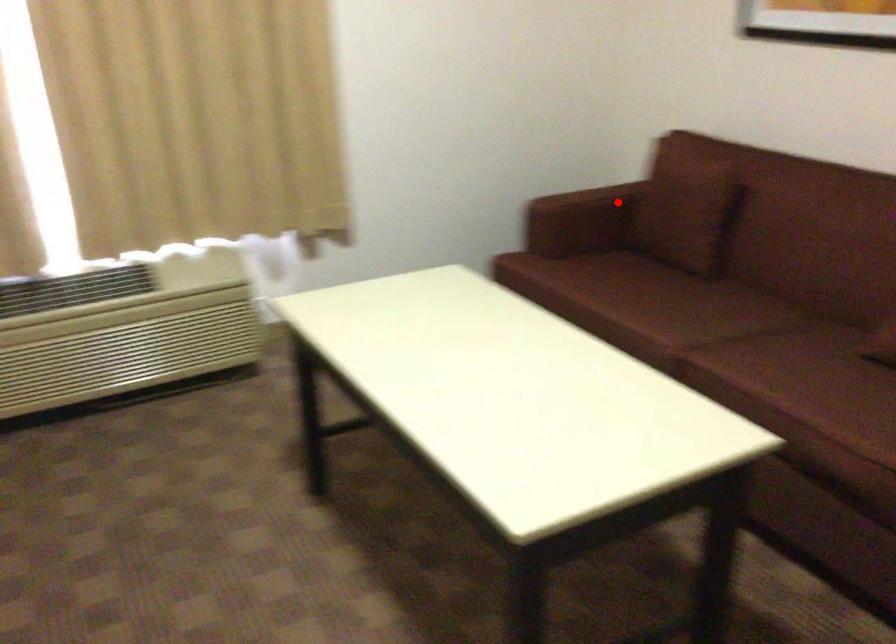
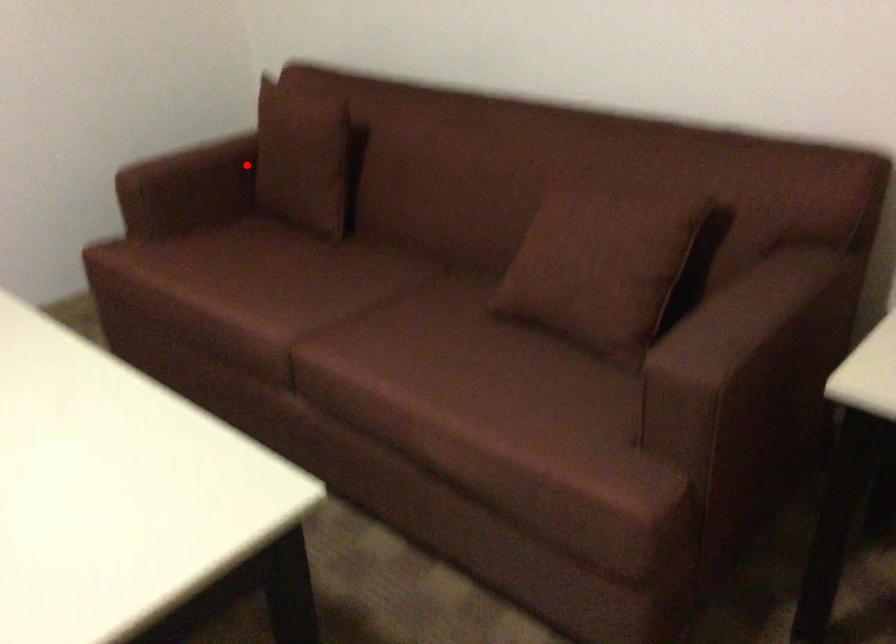
I am providing you with two images of the same scene from different viewpoints. A red point is marked on the first image and another point is marked on the second image. Is the red point in image1 aligned with the point shown in image2?

Yes